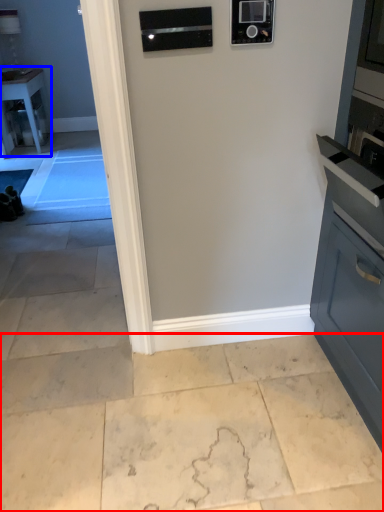
Question: Among these objects, which one is nearest to the camera, concrete (highlighted by a red box) or table (highlighted by a blue box)?

Choices:
 (A) concrete
 (B) table

Answer: (A)